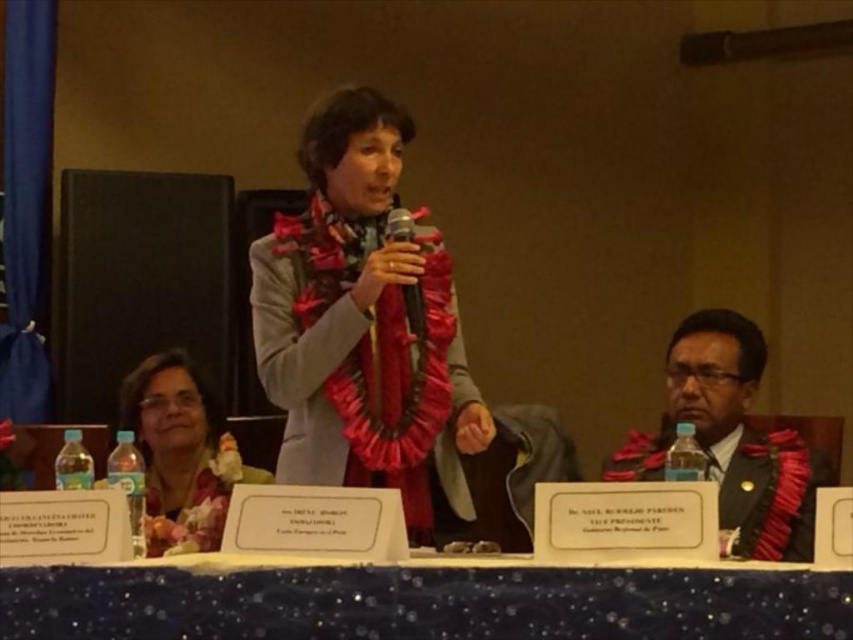
Can you confirm if blue glitter tablecloth at center is taller than matte black scarf at lower right?

No.

Does blue glitter tablecloth at center appear on the right side of matte black scarf at lower right?

In fact, blue glitter tablecloth at center is to the left of matte black scarf at lower right.

Locate an element on the screen. This screenshot has height=640, width=853. blue glitter tablecloth at center is located at coordinates (422, 604).

Where is `blue glitter tablecloth at center`? blue glitter tablecloth at center is located at coordinates [422, 604].

Is matte black scarf at lower right positioned at the back of matte pink scarf at lower left?

No.

Does matte black scarf at lower right appear on the left side of matte pink scarf at lower left?

In fact, matte black scarf at lower right is to the right of matte pink scarf at lower left.

Is point (811, 538) positioned in front of point (215, 541)?

Yes, it is in front of point (215, 541).

The height and width of the screenshot is (640, 853). I want to click on matte black scarf at lower right, so click(x=730, y=440).

Which of these two, matte black scarf at lower right or metallic silver microphone at center, stands taller?

With more height is matte black scarf at lower right.

Which is behind, point (737, 372) or point (416, 292)?

The point (737, 372) is behind.

Measure the distance between point (732, 332) and camera.

They are 2.67 meters apart.

The width and height of the screenshot is (853, 640). Identify the location of matte black scarf at lower right. (730, 440).